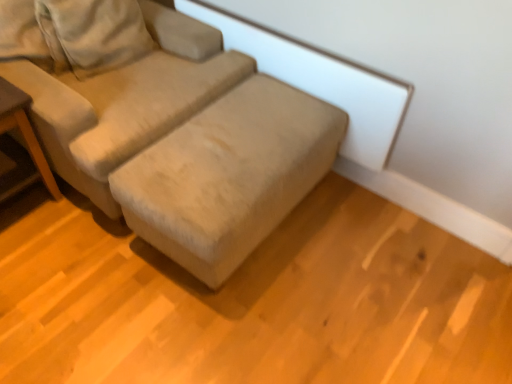
Question: Based on their sizes in the image, would you say wooden table at left is bigger or smaller than beige fabric couch at center?

Choices:
 (A) big
 (B) small

Answer: (B)

Question: From the image's perspective, is wooden table at left located above or below beige fabric couch at center?

Choices:
 (A) below
 (B) above

Answer: (A)

Question: Does point (24, 117) appear closer or farther from the camera than point (202, 67)?

Choices:
 (A) farther
 (B) closer

Answer: (B)

Question: Based on their positions, is beige fabric couch at center located to the left or right of wooden table at left?

Choices:
 (A) left
 (B) right

Answer: (B)

Question: Considering their positions, is beige fabric couch at center located in front of or behind wooden table at left?

Choices:
 (A) front
 (B) behind

Answer: (A)

Question: In terms of width, does beige fabric couch at center look wider or thinner when compared to wooden table at left?

Choices:
 (A) wide
 (B) thin

Answer: (A)

Question: From the image's perspective, is beige fabric couch at center above or below wooden table at left?

Choices:
 (A) below
 (B) above

Answer: (B)